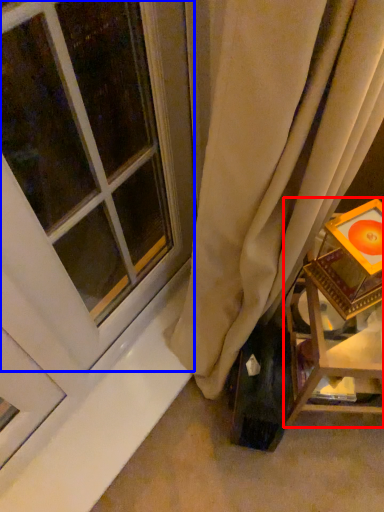
Question: Which point is further to the camera, furniture (highlighted by a red box) or window (highlighted by a blue box)?

Choices:
 (A) furniture
 (B) window

Answer: (A)